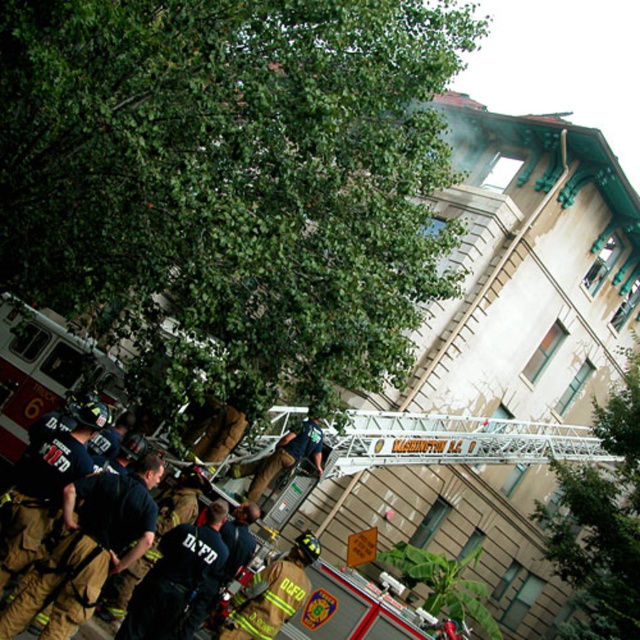
Question: Observing the image, what is the correct spatial positioning of black fabric fireman at lower left in reference to reflective silver helmet at center?

Choices:
 (A) below
 (B) above

Answer: (A)

Question: Among these objects, which one is farthest from the camera?

Choices:
 (A) brown/canvas fireman at center
 (B) black fabric fireman at lower left

Answer: (A)

Question: In this image, where is dark brown uniform at center located relative to brown/canvas fireman at center?

Choices:
 (A) above
 (B) below

Answer: (A)

Question: Which object is farther from the camera taking this photo?

Choices:
 (A) reflective silver helmet at center
 (B) dark brown uniform at center
 (C) black fabric fireman at lower left

Answer: (A)

Question: Estimate the real-world distances between objects in this image. Which object is closer to the dark brown uniform at lower left?

Choices:
 (A) reflective silver helmet at center
 (B) brown/canvas fireman at center
 (C) dark brown uniform at center
 (D) red and white fire truck at lower left

Answer: (C)

Question: Does red and white fire truck at lower left have a larger size compared to dark brown uniform at lower left?

Choices:
 (A) no
 (B) yes

Answer: (B)